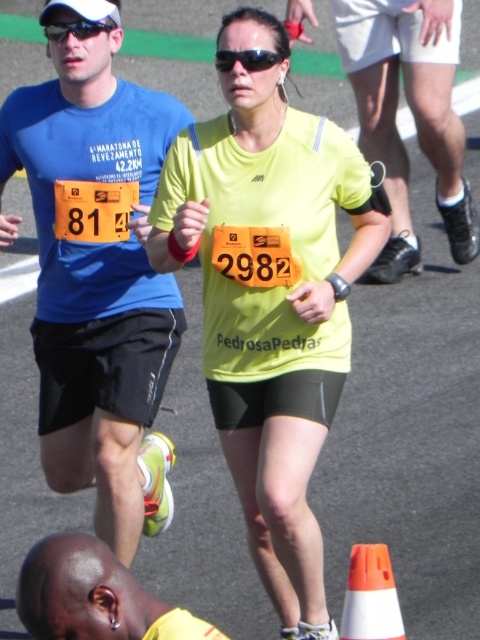
Question: Considering the relative positions of matte yellow shorts at center and black matte sunglasses at center in the image provided, where is matte yellow shorts at center located with respect to black matte sunglasses at center?

Choices:
 (A) left
 (B) right

Answer: (B)

Question: Which point is closer to the camera?

Choices:
 (A) black matte sunglasses at center
 (B) shiny yellow shirt at lower left
 (C) matte blue t-shirt at left

Answer: (B)

Question: Which point appears farthest from the camera in this image?

Choices:
 (A) (57, 570)
 (B) (68, 22)
 (C) (96, 307)
 (D) (260, 349)

Answer: (C)

Question: Based on their relative distances, which object is nearer to the yellow matte shirt at center?

Choices:
 (A) white plastic traffic cone at lower center
 (B) matte blue t-shirt at left
 (C) black plastic sunglasses at upper center

Answer: (B)

Question: Can you confirm if matte yellow shorts at center is wider than orange paper number at center?

Choices:
 (A) no
 (B) yes

Answer: (B)

Question: Is matte yellow shorts at center thinner than white plastic traffic cone at lower center?

Choices:
 (A) yes
 (B) no

Answer: (B)